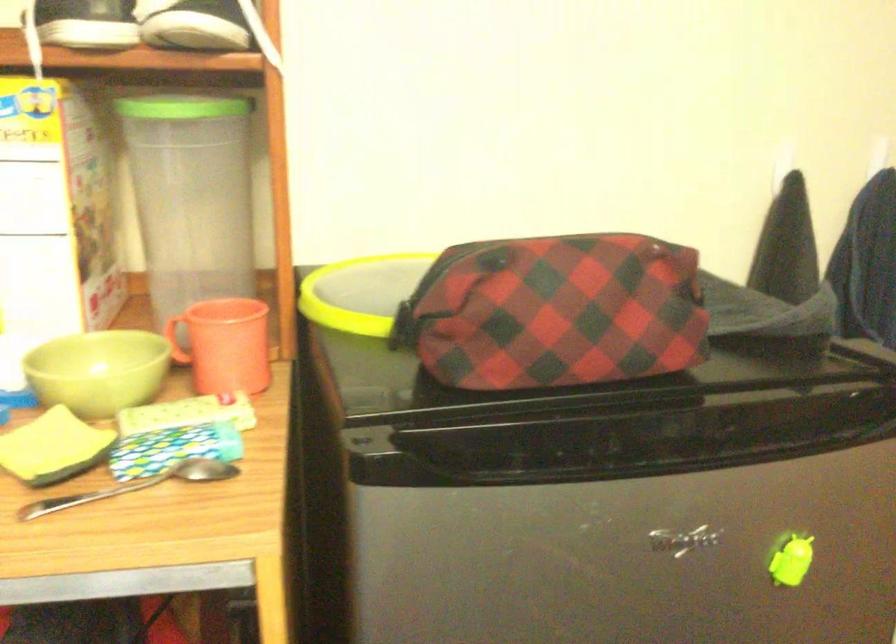
The height and width of the screenshot is (644, 896). What do you see at coordinates (197, 26) in the screenshot?
I see `the black sneaker` at bounding box center [197, 26].